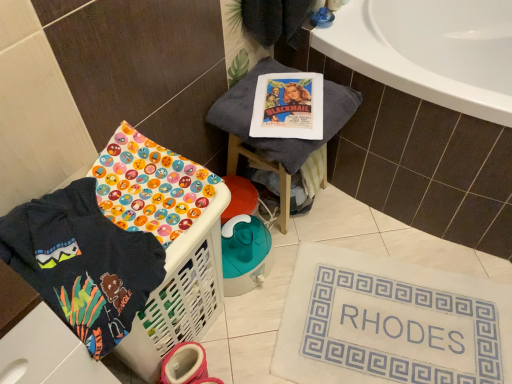
This screenshot has width=512, height=384. Identify the location of free space above white fabric bath mat at lower right (from a real-world perspective). (396, 324).